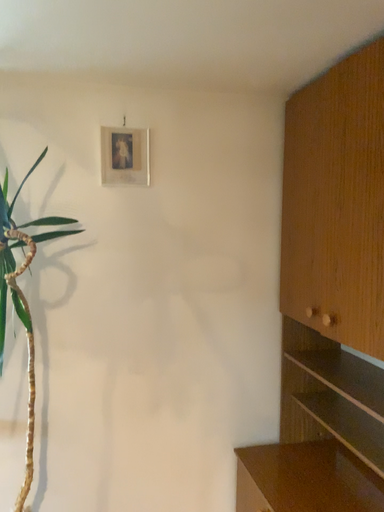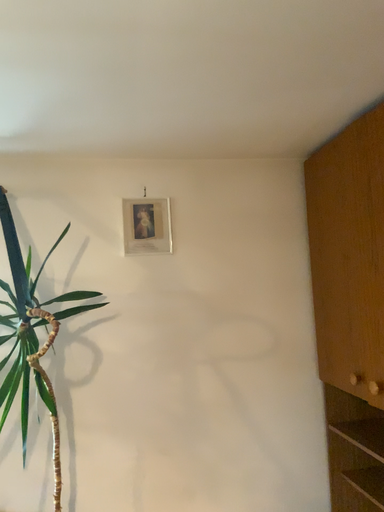
Question: How did the camera likely rotate when shooting the video?

Choices:
 (A) rotated downward
 (B) rotated upward

Answer: (B)